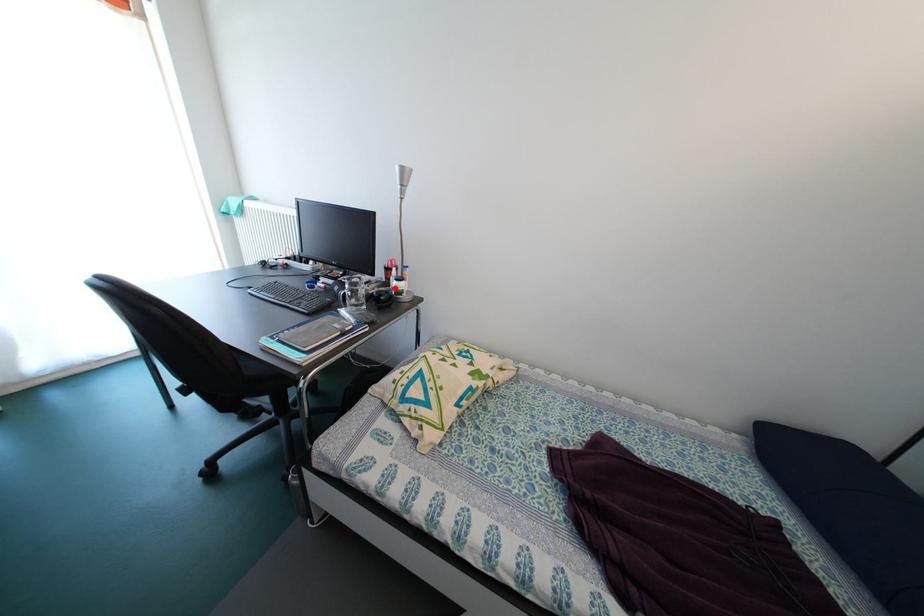
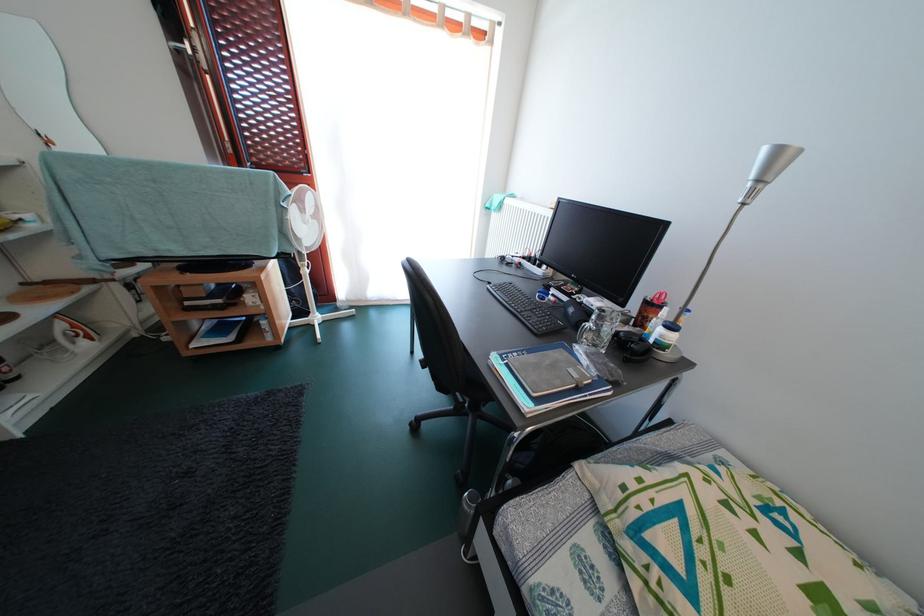
Where in the second image is the point corresponding to the highlighted location from the first image?

(648, 328)